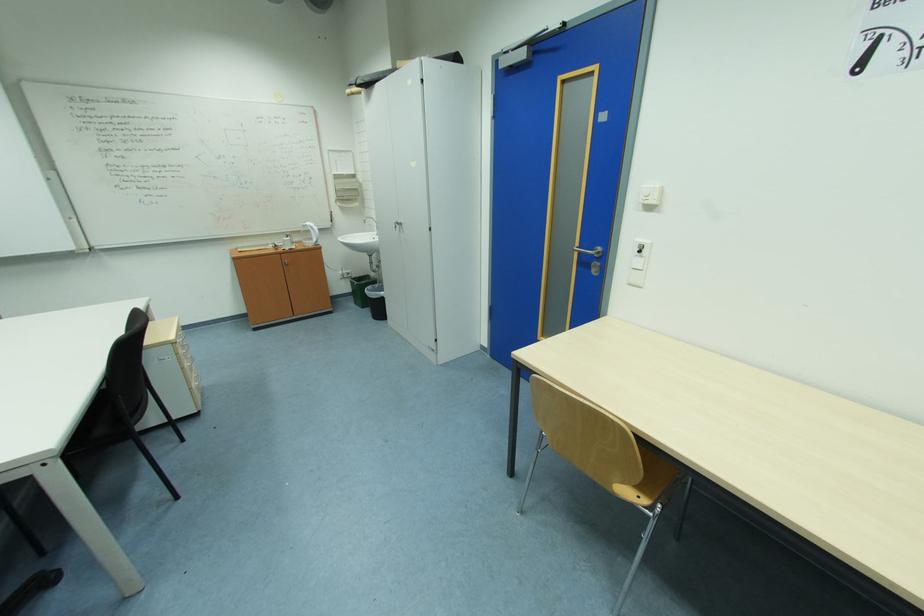
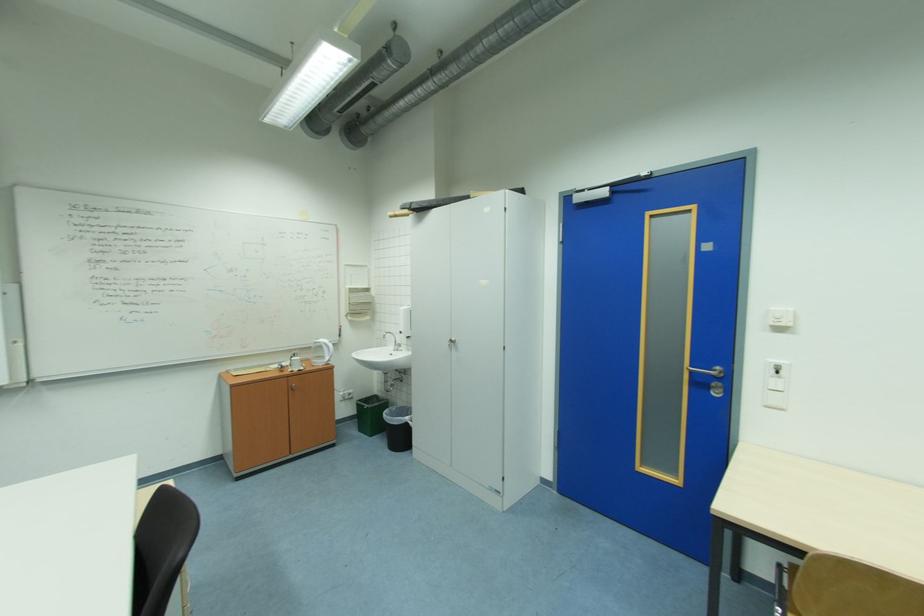
Question: Based on the continuous images, in which direction is the camera rotating? Reply with the corresponding letter.

Choices:
 (A) Left
 (B) Right
 (C) Up
 (D) Down

Answer: (C)